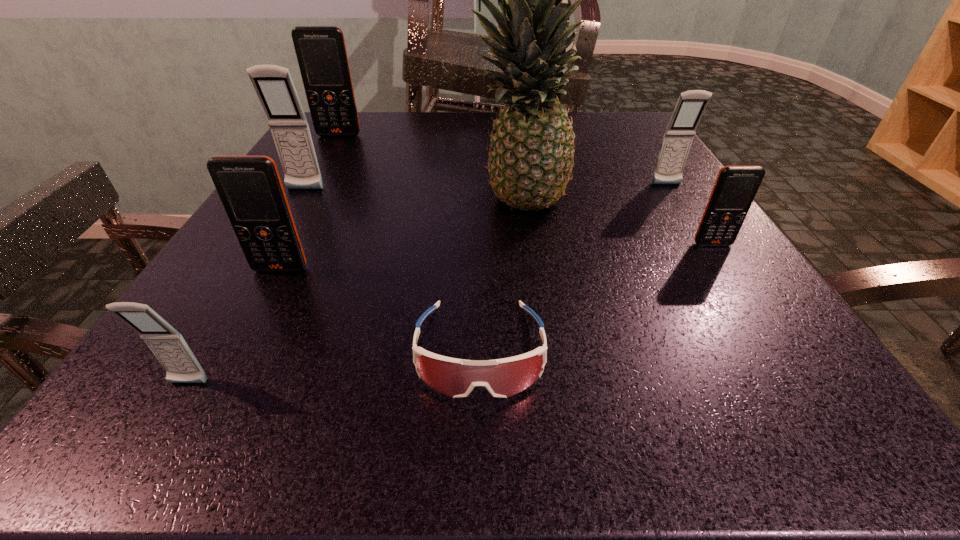
In order to click on vacant space at the far left corner of the desktop in this screenshot , I will do `click(369, 112)`.

Locate an element on the screen. The height and width of the screenshot is (540, 960). vacant space at the near left corner of the desktop is located at coordinates (156, 412).

At what (x,y) coordinates should I click in order to perform the action: click on vacant space at the far right corner. Please return your answer as a coordinate pair (x, y). The width and height of the screenshot is (960, 540). Looking at the image, I should click on (613, 129).

At what (x,y) coordinates should I click in order to perform the action: click on free space between the nearest gray cellular telephone and the shortest object. Please return your answer as a coordinate pair (x, y). The width and height of the screenshot is (960, 540). Looking at the image, I should click on (334, 367).

Where is `blank region between the goggles and the eighth shortest object`? The width and height of the screenshot is (960, 540). blank region between the goggles and the eighth shortest object is located at coordinates (506, 237).

The width and height of the screenshot is (960, 540). Find the location of `free spot between the fifth cellular telephone from left to right and the goggles`. free spot between the fifth cellular telephone from left to right and the goggles is located at coordinates (506, 237).

This screenshot has width=960, height=540. I want to click on free area in between the green pineapple and the smallest orange cellular telephone, so click(x=614, y=224).

You are a GUI agent. You are given a task and a screenshot of the screen. Output one action in this format:
    pyautogui.click(x=<x>, y=<y>)
    Task: Click on the blank region between the biggest orange cellular telephone and the fifth farthest cellular telephone
    This screenshot has width=960, height=540.
    Given the screenshot: What is the action you would take?
    pyautogui.click(x=622, y=185)

What are the coordinates of `vacant space that is in between the shortest object and the second smallest gray cellular telephone` in the screenshot? It's located at (573, 267).

Where is `vacant space that's between the rightmost gray cellular telephone and the third nearest cellular telephone`? Image resolution: width=960 pixels, height=540 pixels. vacant space that's between the rightmost gray cellular telephone and the third nearest cellular telephone is located at coordinates pos(689,214).